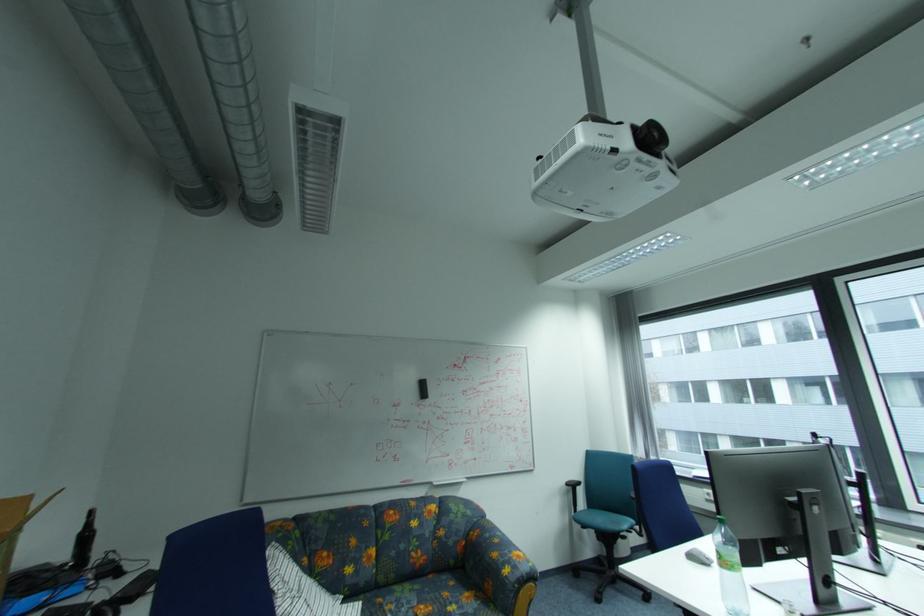
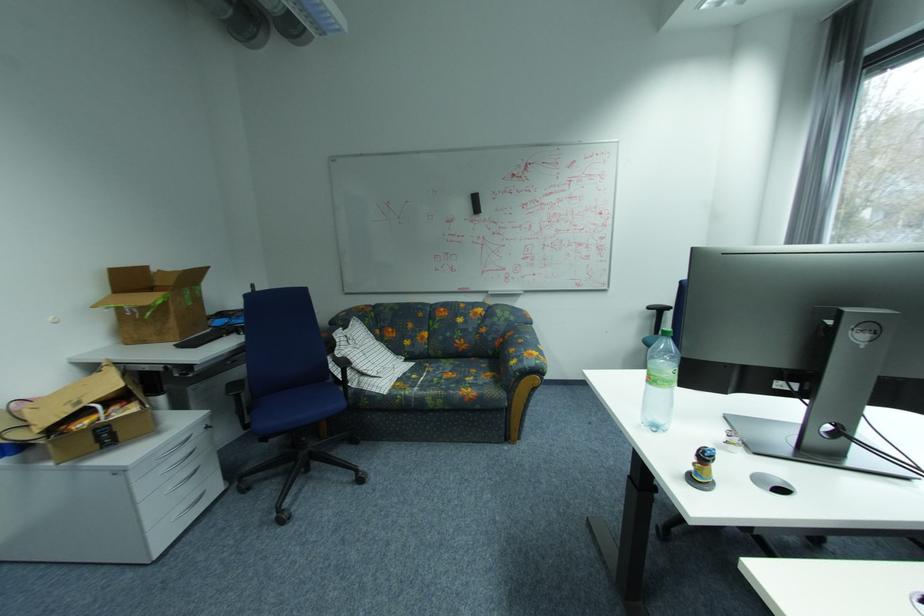
Locate, in the second image, the point that corresponds to pixel 515 572 in the first image.

(521, 363)